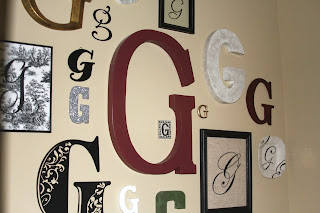
Where is `corner of walls`? corner of walls is located at coordinates (277, 33).